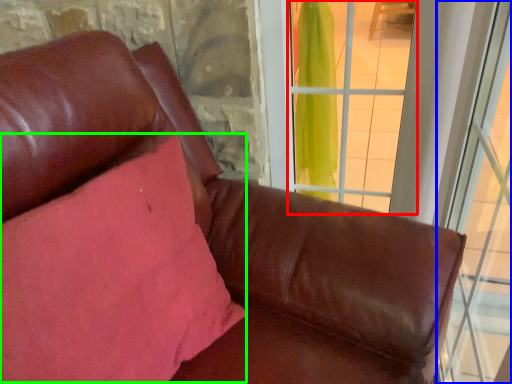
Question: Considering the real-world distances, which object is closest to window (highlighted by a red box)? window (highlighted by a blue box) or pillow (highlighted by a green box).

Choices:
 (A) window
 (B) pillow

Answer: (A)